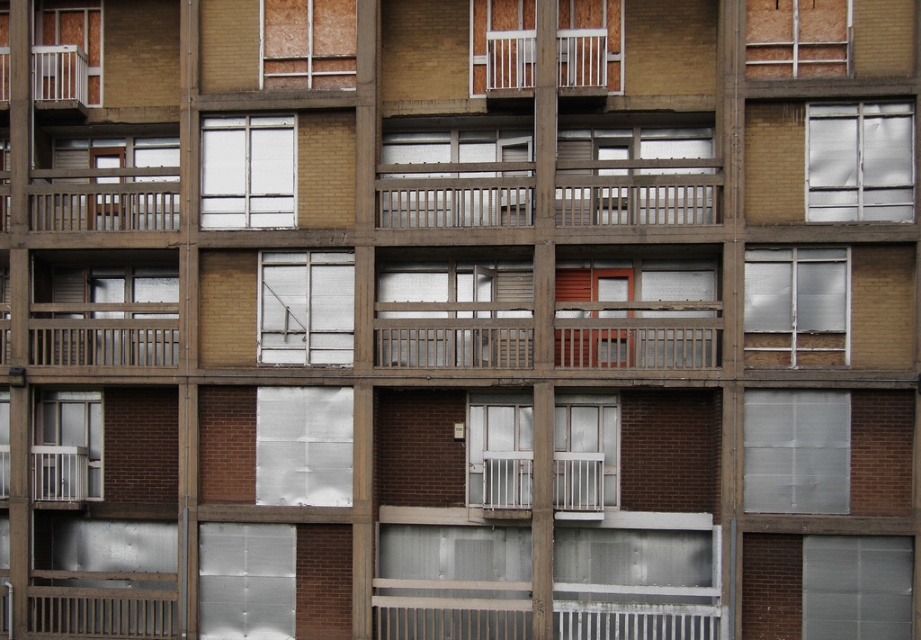
Does wooden frame at upper right appear over wooden railing at upper left?

Yes.

Is point (811, 29) closer to viewer compared to point (49, 195)?

Yes, point (811, 29) is in front of point (49, 195).

This screenshot has width=921, height=640. I want to click on wooden frame at upper right, so click(797, 36).

Between transparent plastic window at lower right and white matte window at upper center, which one has more height?

Standing taller between the two is white matte window at upper center.

Is point (825, 556) farther from camera compared to point (251, 163)?

No, (825, 556) is closer to viewer.

In order to click on transparent plastic window at lower right in this screenshot , I will do `click(857, 586)`.

Locate an element on the screen. This screenshot has width=921, height=640. transparent plastic window at lower right is located at coordinates (857, 586).

Who is positioned more to the left, transparent plastic window at lower right or clear glass window at center?

clear glass window at center

This screenshot has height=640, width=921. I want to click on transparent plastic window at lower right, so click(x=857, y=586).